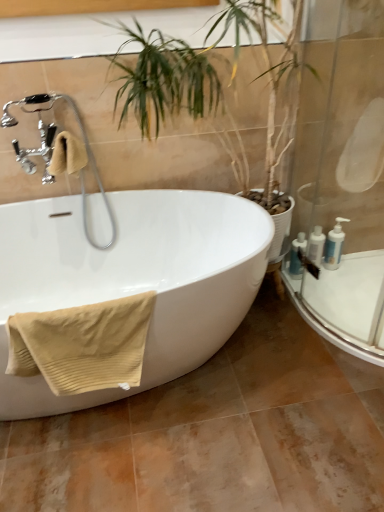
Question: Is beige ribbed towel at left, the 2th bath towel from the front, to the left of white glossy bottles at right, placed as the first toiletry when sorted from left to right, from the viewer's perspective?

Choices:
 (A) yes
 (B) no

Answer: (A)

Question: Does beige ribbed towel at left, which appears as the 1th bath towel when viewed from the top, have a smaller size compared to white glossy bottles at right, placed as the first toiletry when sorted from left to right?

Choices:
 (A) no
 (B) yes

Answer: (A)

Question: Considering the relative sizes of beige ribbed towel at left, the 2th bath towel from the front, and white glossy bottles at right, the third toiletry from the right, in the image provided, is beige ribbed towel at left, the 2th bath towel from the front, bigger than white glossy bottles at right, the third toiletry from the right,?

Choices:
 (A) no
 (B) yes

Answer: (B)

Question: Is beige ribbed towel at left, the 2th bath towel from the front, wider than white glossy bottles at right, the third toiletry from the right?

Choices:
 (A) no
 (B) yes

Answer: (B)

Question: Can you confirm if beige ribbed towel at left, the 2th bath towel from the front, is taller than white glossy bottles at right, the third toiletry from the right?

Choices:
 (A) no
 (B) yes

Answer: (A)

Question: In terms of width, does transparent glass shower door at right look wider or thinner when compared to white glossy bottle at right, the second toiletry from the left?

Choices:
 (A) thin
 (B) wide

Answer: (B)

Question: Visually, is transparent glass shower door at right positioned to the left or to the right of white glossy bottle at right, the second toiletry from the left?

Choices:
 (A) left
 (B) right

Answer: (A)

Question: Considering the positions of point (372, 36) and point (316, 225), is point (372, 36) closer or farther from the camera than point (316, 225)?

Choices:
 (A) closer
 (B) farther

Answer: (A)

Question: From the image's perspective, is transparent glass shower door at right located above or below white glossy bottle at right, which is the 2th toiletry in right-to-left order?

Choices:
 (A) above
 (B) below

Answer: (A)

Question: Which is correct: beige ribbed towel at lower left, which is the first bath towel from bottom to top, is inside white glossy pump bottles at right, the third toiletry in the left-to-right sequence, or outside of it?

Choices:
 (A) inside
 (B) outside

Answer: (B)

Question: Based on their positions, is beige ribbed towel at lower left, the first bath towel from the front, located to the left or right of white glossy pump bottles at right, the third toiletry in the left-to-right sequence?

Choices:
 (A) right
 (B) left

Answer: (B)

Question: In terms of height, does beige ribbed towel at lower left, the second bath towel in the back-to-front sequence, look taller or shorter compared to white glossy pump bottles at right, positioned as the first toiletry in right-to-left order?

Choices:
 (A) short
 (B) tall

Answer: (B)

Question: From the image's perspective, is beige ribbed towel at lower left, which ranks as the 2th bath towel in top-to-bottom order, above or below white glossy pump bottles at right, positioned as the first toiletry in right-to-left order?

Choices:
 (A) below
 (B) above

Answer: (A)

Question: Considering the positions of point (41, 97) and point (19, 268), is point (41, 97) closer or farther from the camera than point (19, 268)?

Choices:
 (A) closer
 (B) farther

Answer: (A)

Question: Considering the positions of chrome/metallic faucet at upper left and white glossy bathtub at center in the image, is chrome/metallic faucet at upper left wider or thinner than white glossy bathtub at center?

Choices:
 (A) wide
 (B) thin

Answer: (B)